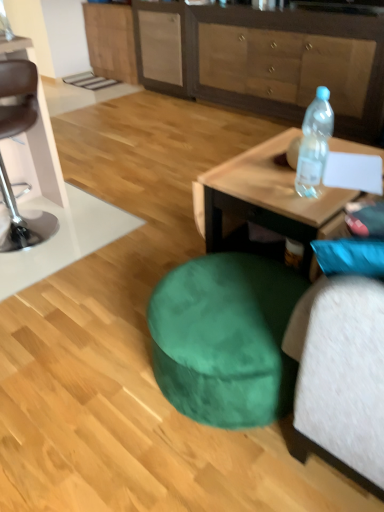
Where is `vacant area located to the right-hand side of transparent plastic bottle at upper right`? This screenshot has width=384, height=512. vacant area located to the right-hand side of transparent plastic bottle at upper right is located at coordinates (340, 194).